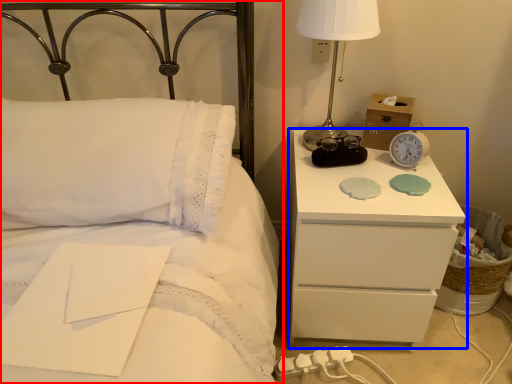
Question: Among these objects, which one is farthest to the camera, bed (highlighted by a red box) or nightstand (highlighted by a blue box)?

Choices:
 (A) bed
 (B) nightstand

Answer: (B)